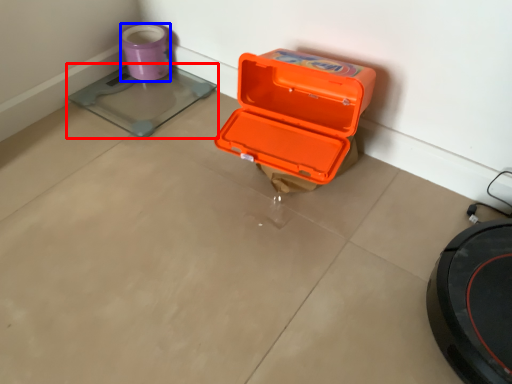
Question: Which point is closer to the camera, weight scale (highlighted by a red box) or appliance (highlighted by a blue box)?

Choices:
 (A) weight scale
 (B) appliance

Answer: (A)